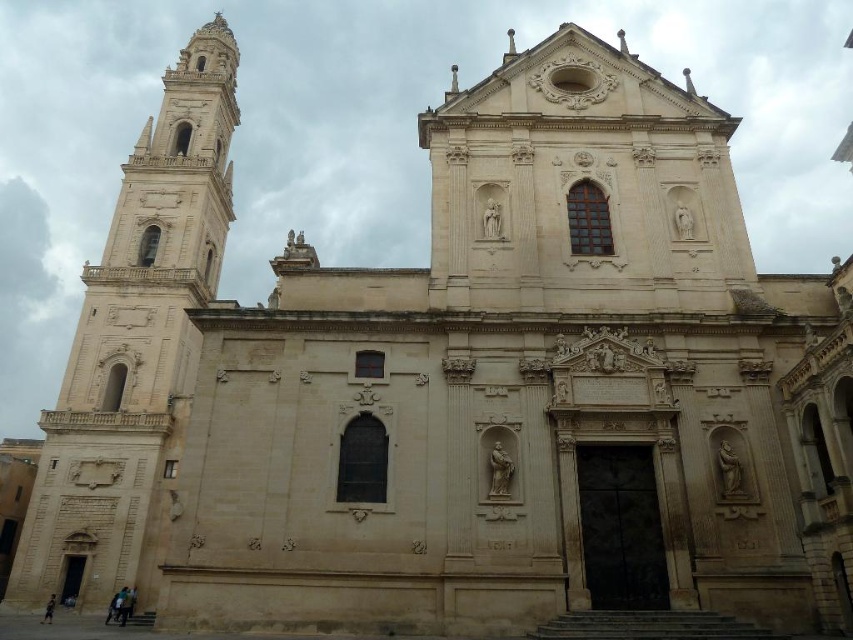
Question: Is smooth beige statue at center wider than light brown sandal at lower left?

Choices:
 (A) no
 (B) yes

Answer: (A)

Question: Considering the relative positions of beige stone tower at left and light brown sandal at lower left in the image provided, where is beige stone tower at left located with respect to light brown sandal at lower left?

Choices:
 (A) above
 (B) below

Answer: (A)

Question: Which object appears closest to the camera in this image?

Choices:
 (A) light brown sandal at lower left
 (B) smooth beige statue at center
 (C) beige stone tower at left

Answer: (B)

Question: Which point is closer to the camera?

Choices:
 (A) smooth beige statue at center
 (B) beige stone tower at left

Answer: (A)

Question: Does beige stone tower at left come in front of light brown sandal at lower left?

Choices:
 (A) no
 (B) yes

Answer: (B)

Question: Which of the following is the farthest from the observer?

Choices:
 (A) (50, 621)
 (B) (498, 465)

Answer: (A)